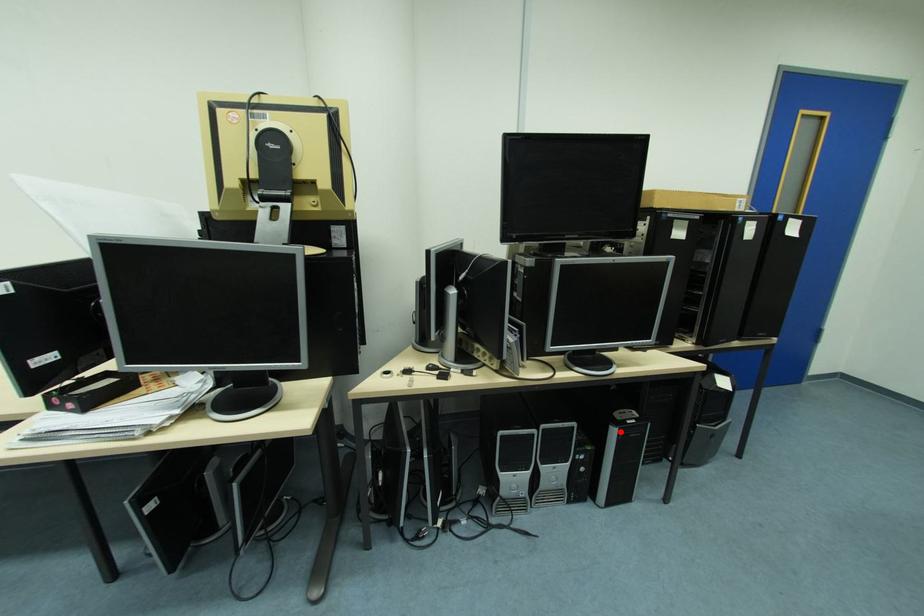
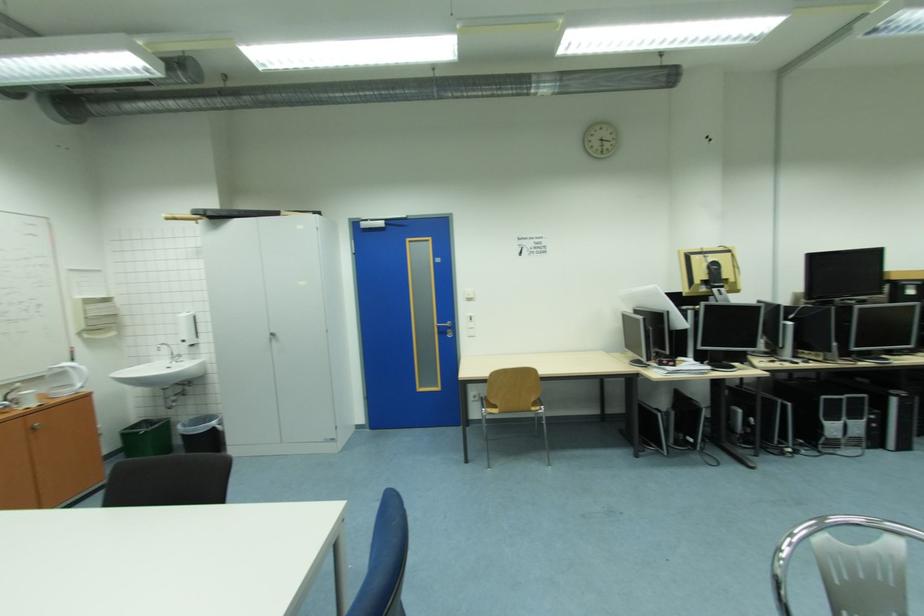
Question: I am providing you with two images of the same scene from different viewpoints. A red point is shown in image1. For the corresponding object point in image2, is it positioned nearer or farther from the camera?

Choices:
 (A) Nearer
 (B) Farther

Answer: (A)